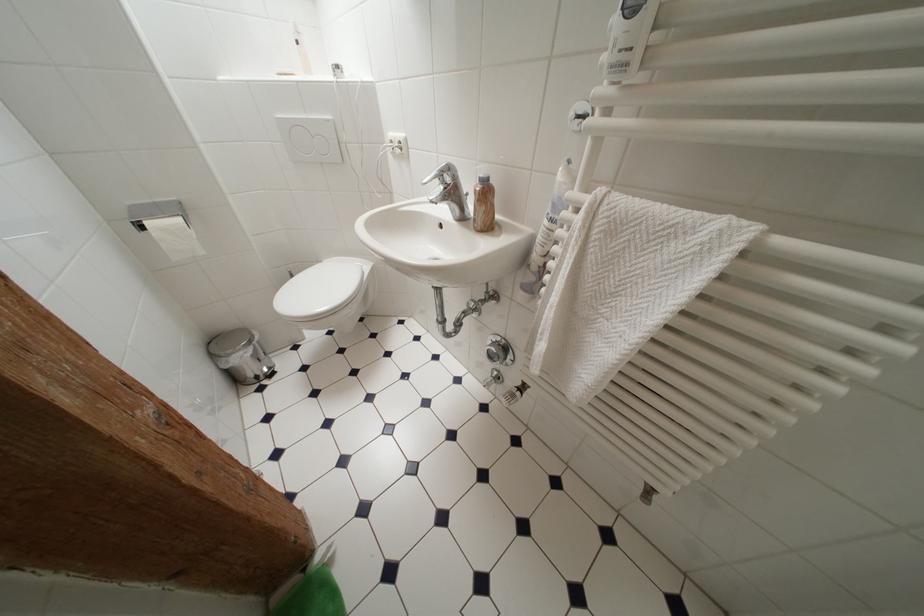
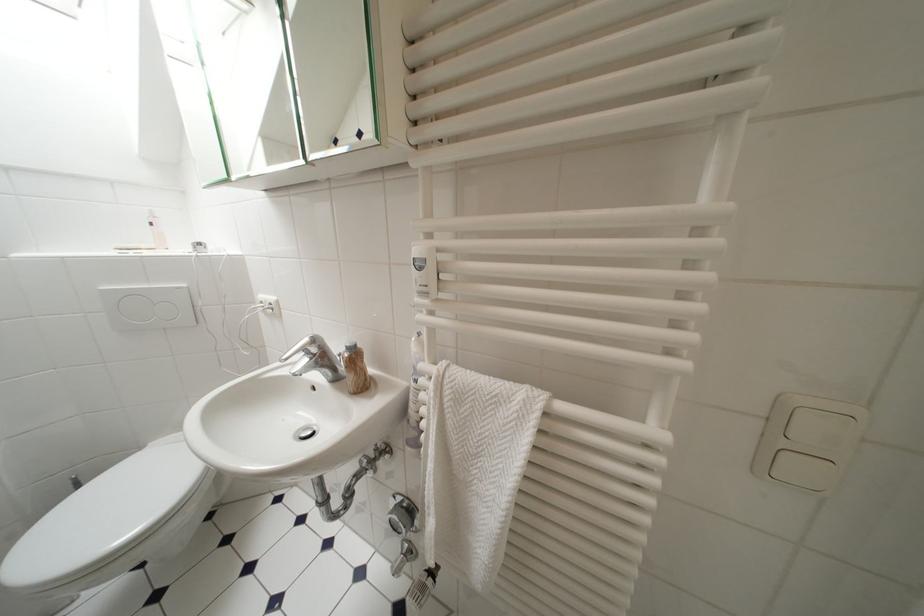
The point at (456, 171) is marked in the first image. Where is the corresponding point in the second image?

(322, 342)